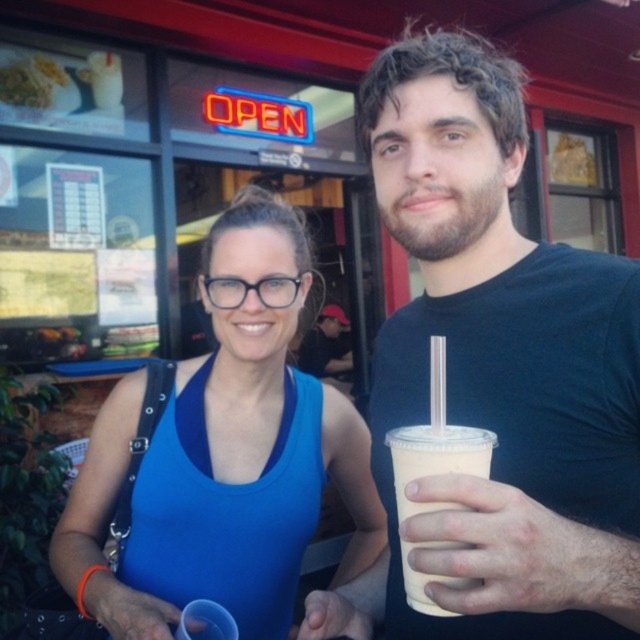
Question: Is black matte cup at center smaller than white glossy plate at upper left?

Choices:
 (A) yes
 (B) no

Answer: (B)

Question: Estimate the real-world distances between objects in this image. Which object is farther from the white glossy plate at upper left?

Choices:
 (A) blue fabric tank top at center
 (B) ivory matte cup at right
 (C) black matte cup at center

Answer: (B)

Question: Observing the image, what is the correct spatial positioning of black matte cup at center in reference to ivory matte cup at right?

Choices:
 (A) above
 (B) below

Answer: (A)

Question: Among these objects, which one is farthest from the camera?

Choices:
 (A) white glossy plate at upper left
 (B) blue fabric tank top at center
 (C) ivory matte cup at right
 (D) black matte cup at center

Answer: (A)

Question: Which object is farther from the camera taking this photo?

Choices:
 (A) white glossy plate at upper left
 (B) ivory matte cup at right

Answer: (A)

Question: Can you confirm if black matte cup at center is thinner than white glossy plate at upper left?

Choices:
 (A) yes
 (B) no

Answer: (B)